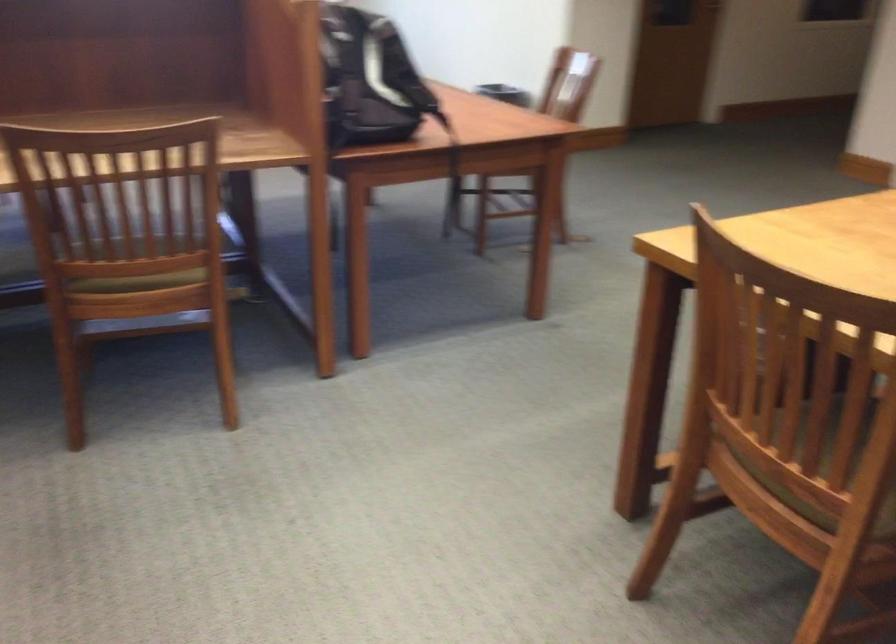
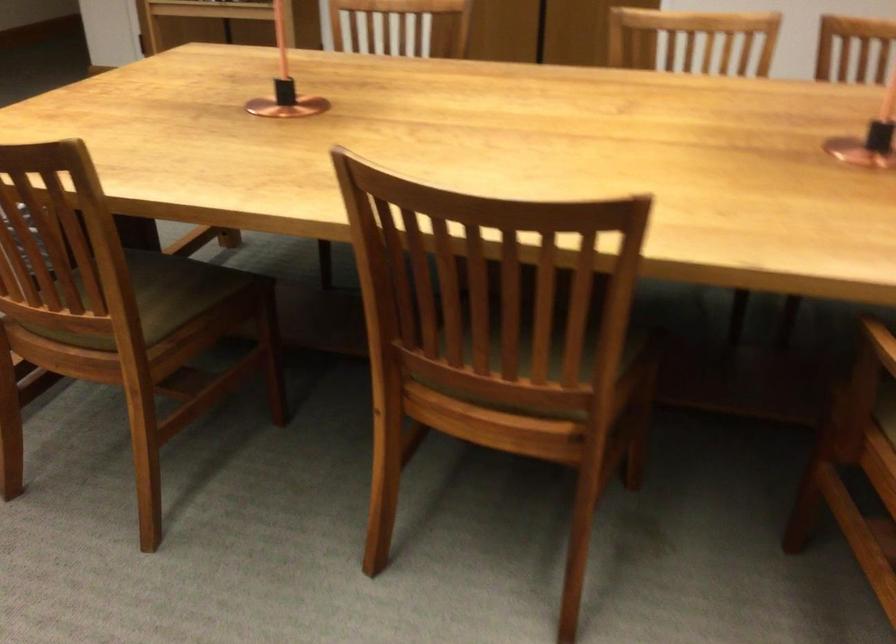
Question: The first image is from the beginning of the video and the second image is from the end. How did the camera likely rotate when shooting the video?

Choices:
 (A) Left
 (B) Right
 (C) Up
 (D) Down

Answer: (B)